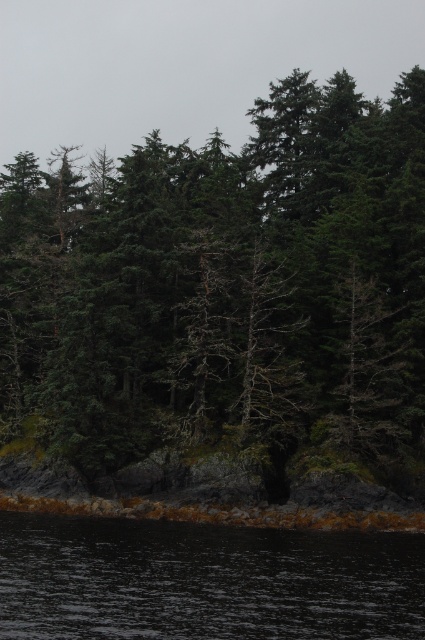
Who is more forward, (x=291, y=448) or (x=263, y=561)?

Point (x=263, y=561) is more forward.

Does green matte tree at center have a larger size compared to dark water at lower center?

Indeed, green matte tree at center has a larger size compared to dark water at lower center.

Find the location of a particular element. Image resolution: width=425 pixels, height=640 pixels. green matte tree at center is located at coordinates (226, 291).

Where is `green matte tree at center`? This screenshot has height=640, width=425. green matte tree at center is located at coordinates (226, 291).